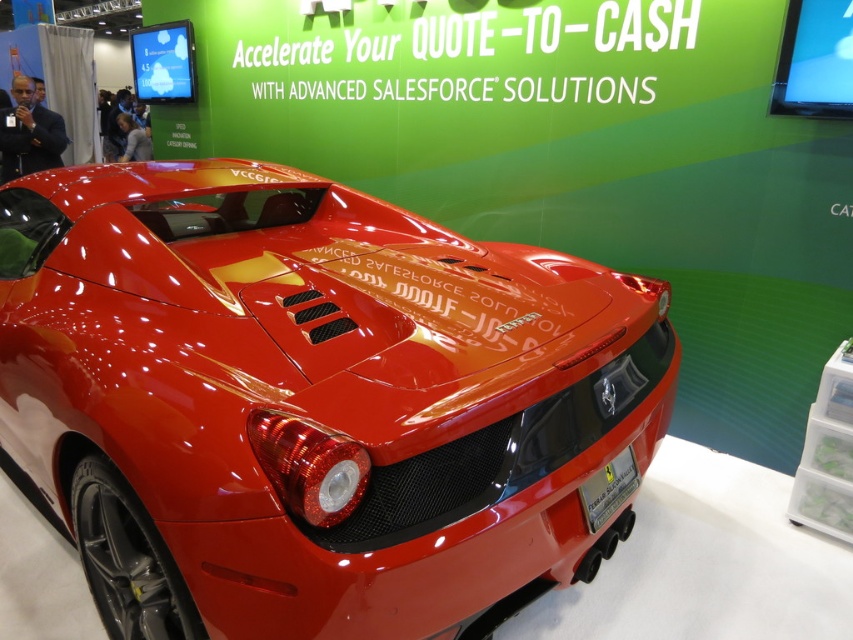
You are a photographer at the exhibition and need to capture both the glossy red sports car at center and the metallic silver license plate at center in a single frame. Given that the camera can only focus on one object at a time, which object should you focus on to ensure the license plate remains in the background?

You should focus on the glossy red sports car at center because it is larger and closer to the camera than the metallic silver license plate at center, ensuring the license plate stays in the background.

You are a photographer who needs to capture the glossy red sports car at center and the metallic silver license plate at center in a single shot. Since you want to ensure both are clearly visible, which object should you focus on first to maintain sharpness?

The glossy red sports car at center is much taller than the metallic silver license plate at center, so you should focus on the metallic silver license plate at center first as it is closer to the camera.

You are standing at the entrance of the trade show and want to take a photo of the Ferrari sports car. The two points you see are point 1 at coordinates point (x=126, y=209) and point 2 at coordinates point (x=608, y=515). Which point is closer to you when you take the photo?

Point (x=126, y=209) is closer to you because it is further to the camera than point (x=608, y=515).